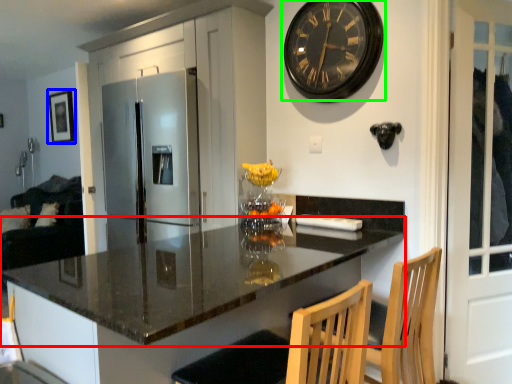
Question: Based on their relative distances, which object is farther from countertop (highlighted by a red box)? Choose from picture frame (highlighted by a blue box) and wall clock (highlighted by a green box).

Choices:
 (A) picture frame
 (B) wall clock

Answer: (A)